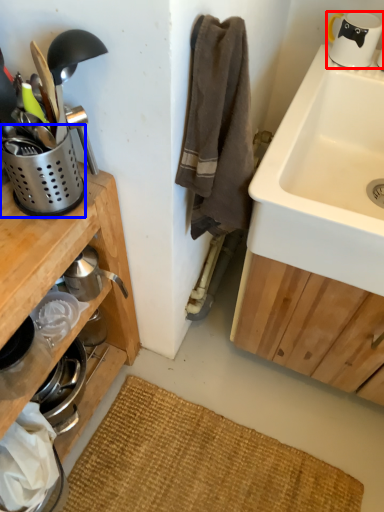
Question: Which object is further to the camera taking this photo, coffee cup (highlighted by a red box) or appliance (highlighted by a blue box)?

Choices:
 (A) coffee cup
 (B) appliance

Answer: (A)